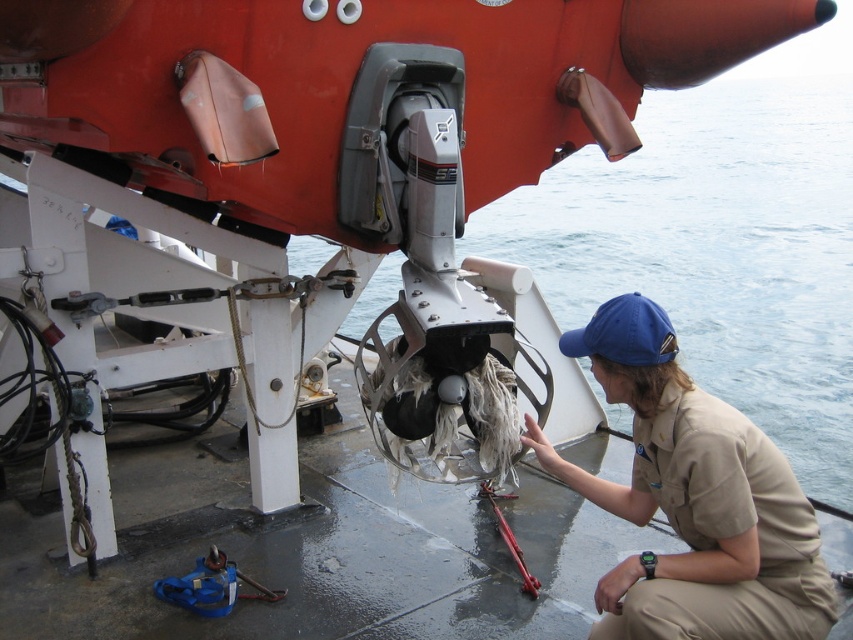
Can you confirm if khaki uniform at lower right is positioned to the right of blue fabric baseball cap at center?

Correct, you'll find khaki uniform at lower right to the right of blue fabric baseball cap at center.

Can you confirm if khaki uniform at lower right is smaller than blue fabric baseball cap at center?

No.

Is point (830, 580) closer to viewer compared to point (618, 353)?

Yes, point (830, 580) is in front of point (618, 353).

This screenshot has width=853, height=640. Find the location of `khaki uniform at lower right`. khaki uniform at lower right is located at coordinates (693, 499).